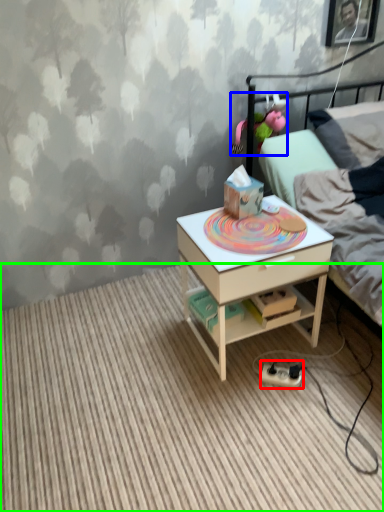
Question: Based on their relative distances, which object is farther from equipment (highlighted by a red box)? Choose from toy (highlighted by a blue box) and plain (highlighted by a green box).

Choices:
 (A) toy
 (B) plain

Answer: (A)